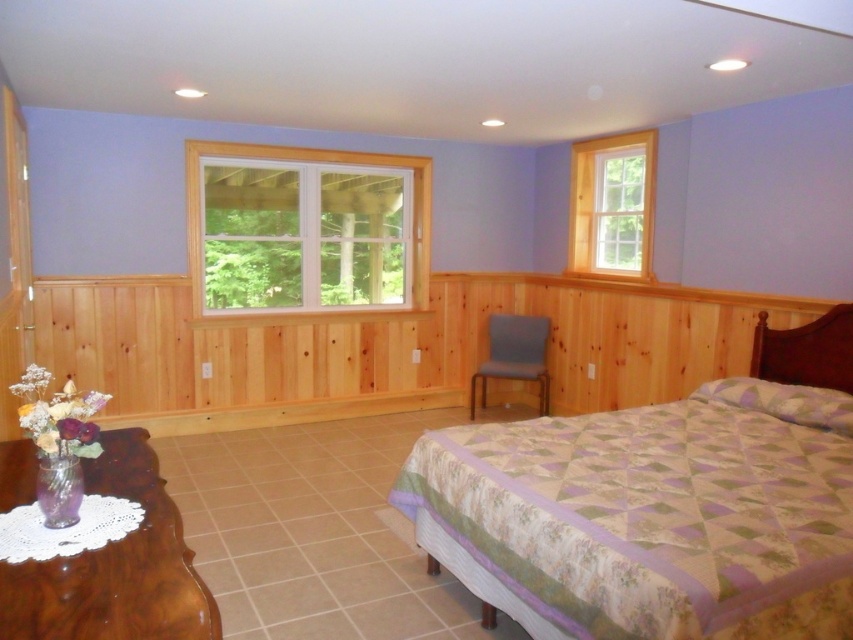
Can you confirm if patterned fabric bed at center is thinner than translucent glass vase at lower left?

No, patterned fabric bed at center is not thinner than translucent glass vase at lower left.

Can you confirm if patterned fabric bed at center is positioned below translucent glass vase at lower left?

Yes.

Image resolution: width=853 pixels, height=640 pixels. I want to click on patterned fabric bed at center, so click(659, 506).

Which is behind, point (633, 140) or point (546, 339)?

Positioned behind is point (546, 339).

Between point (595, 189) and point (543, 356), which one is positioned in front?

Point (595, 189)

This screenshot has height=640, width=853. I want to click on clear glass window at upper right, so click(612, 204).

Does white plastic window at upper left lie behind matte blue chair at center?

No.

Which is above, white plastic window at upper left or matte blue chair at center?

white plastic window at upper left is higher up.

Is point (422, 166) behind point (473, 419)?

Yes, point (422, 166) is farther from viewer.

Image resolution: width=853 pixels, height=640 pixels. Identify the location of white plastic window at upper left. (314, 214).